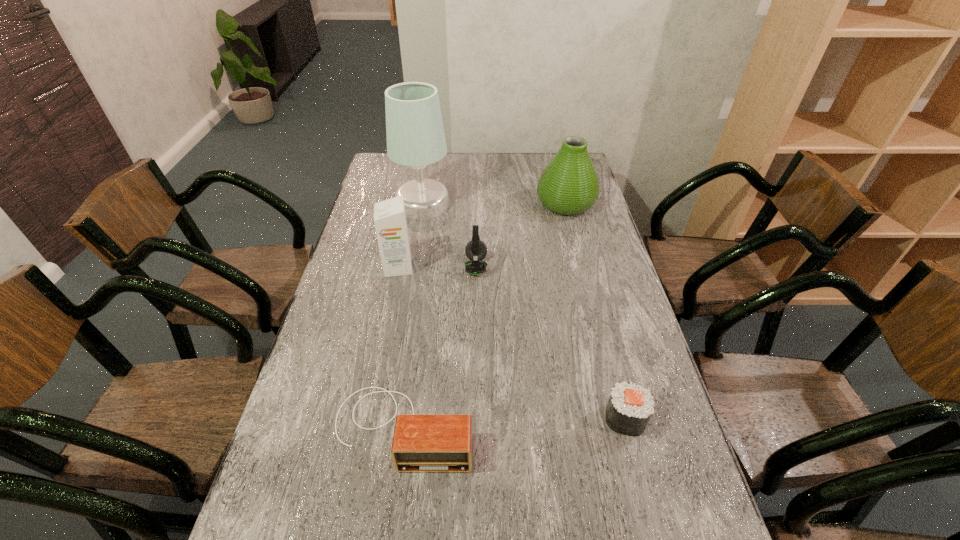
In the image, there is a desktop. At what (x,y) coordinates should I click in order to perform the action: click on vacant space at the far left corner. Please return your answer as a coordinate pair (x, y). This screenshot has height=540, width=960. Looking at the image, I should click on (405, 180).

I want to click on blank region between the radio receiver and the carton, so click(401, 347).

This screenshot has width=960, height=540. I want to click on free area in between the sushi and the radio receiver, so click(514, 423).

Where is `vacant area between the headset and the radio receiver`? Image resolution: width=960 pixels, height=540 pixels. vacant area between the headset and the radio receiver is located at coordinates (440, 347).

Locate an element on the screen. This screenshot has width=960, height=540. empty space that is in between the fourth tallest object and the carton is located at coordinates (438, 267).

The image size is (960, 540). Find the location of `free space between the vase and the radio receiver`. free space between the vase and the radio receiver is located at coordinates (485, 315).

Find the location of `vacant region between the vase and the carton`. vacant region between the vase and the carton is located at coordinates [482, 235].

Locate an element on the screen. empty space between the radio receiver and the vase is located at coordinates (485, 315).

Identify the location of free space between the sushi and the carton. This screenshot has height=540, width=960. (512, 342).

You are a GUI agent. You are given a task and a screenshot of the screen. Output one action in this format:
    pyautogui.click(x=<x>, y=<y>)
    Task: Click on the object that is the second nearest to the fourth tallest object
    
    Given the screenshot: What is the action you would take?
    pyautogui.click(x=415, y=135)